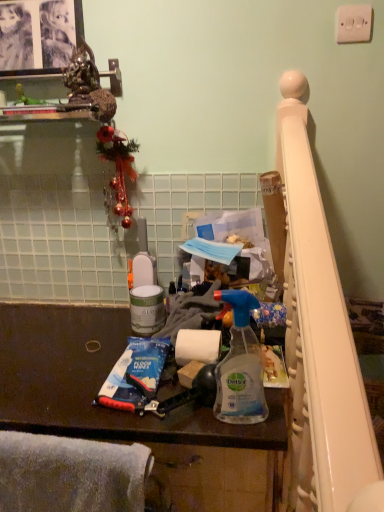
What is the approximate height of transparent plastic spray bottle at center?

The height of transparent plastic spray bottle at center is 11.19 inches.

I want to click on transparent plastic spray bottle at center, so click(240, 366).

What do you see at coordinates (135, 414) in the screenshot?
I see `dark brown laminate counter at center` at bounding box center [135, 414].

I want to click on white glossy paint can at center, so click(147, 309).

The image size is (384, 512). What are the coordinates of `transparent plastic spray bottle at center` in the screenshot? It's located at (240, 366).

How different are the orientations of transparent plastic spray bottle at center and dark brown laminate counter at center in degrees?

The angular difference between transparent plastic spray bottle at center and dark brown laminate counter at center is 0.00249 degrees.

Is transparent plastic spray bottle at center positioned with its back to dark brown laminate counter at center?

No, transparent plastic spray bottle at center is not facing away from dark brown laminate counter at center.

Is transparent plastic spray bottle at center taller or shorter than dark brown laminate counter at center?

In the image, transparent plastic spray bottle at center appears to be shorter than dark brown laminate counter at center.

From the image's perspective, which object appears higher, transparent plastic spray bottle at center or dark brown laminate counter at center?

transparent plastic spray bottle at center, from the image's perspective.

From the image's perspective, between white soft towel at lower left and white glossy paint can at center, which one is located above?

white glossy paint can at center is shown above in the image.

Is the depth of white soft towel at lower left greater than that of white glossy paint can at center?

No, white soft towel at lower left is closer to the camera.

Which object is wider, white soft towel at lower left or white glossy paint can at center?

white glossy paint can at center is wider.

Can you confirm if white soft towel at lower left is positioned to the left of white glossy paint can at center?

Yes.

Are white glossy paint can at center and transparent plastic spray bottle at center beside each other?

white glossy paint can at center is not next to transparent plastic spray bottle at center, and they're not touching.

Does white glossy paint can at center contain transparent plastic spray bottle at center?

No, white glossy paint can at center does not contain transparent plastic spray bottle at center.

Who is smaller, white glossy paint can at center or transparent plastic spray bottle at center?

Smaller between the two is white glossy paint can at center.

Can you confirm if white glossy paint can at center is thinner than transparent plastic spray bottle at center?

No, white glossy paint can at center is not thinner than transparent plastic spray bottle at center.

Which is correct: white soft towel at lower left is inside white plastic light switch at upper right, or outside of it?

white soft towel at lower left lies outside white plastic light switch at upper right.

The width and height of the screenshot is (384, 512). Find the location of `blanket in front of the white plastic light switch at upper right`. blanket in front of the white plastic light switch at upper right is located at coordinates pos(71,474).

Would you say white soft towel at lower left is a long distance from white plastic light switch at upper right?

Yes.

Which object is closer to the camera, white soft towel at lower left or white plastic light switch at upper right?

Positioned in front is white soft towel at lower left.

How much distance is there between blue plastic toothpaste at lower center and black glossy picture frame at upper left?

They are 35.18 inches apart.

Is blue plastic toothpaste at lower center to the left of black glossy picture frame at upper left from the viewer's perspective?

Incorrect, blue plastic toothpaste at lower center is not on the left side of black glossy picture frame at upper left.

Does blue plastic toothpaste at lower center have a smaller size compared to black glossy picture frame at upper left?

Yes.

Is blue plastic toothpaste at lower center touching black glossy picture frame at upper left?

No.

Considering the sizes of transparent plastic spray bottle at center and blue plastic toothpaste at lower center in the image, is transparent plastic spray bottle at center taller or shorter than blue plastic toothpaste at lower center?

Considering their sizes, transparent plastic spray bottle at center has more height than blue plastic toothpaste at lower center.

Is transparent plastic spray bottle at center in front of or behind blue plastic toothpaste at lower center in the image?

Clearly, transparent plastic spray bottle at center is in front of blue plastic toothpaste at lower center.

From the image's perspective, is transparent plastic spray bottle at center above or below blue plastic toothpaste at lower center?

transparent plastic spray bottle at center is situated higher than blue plastic toothpaste at lower center in the image.

Could you measure the distance between transparent plastic spray bottle at center and blue plastic toothpaste at lower center?

The distance of transparent plastic spray bottle at center from blue plastic toothpaste at lower center is 9.12 inches.

Does white glossy paint can at center touch dark brown laminate counter at center?

No, white glossy paint can at center is not next to dark brown laminate counter at center.

Looking at this image, is white glossy paint can at center turned away from dark brown laminate counter at center?

white glossy paint can at center is not turned away from dark brown laminate counter at center.

In the scene shown: Is white glossy paint can at center not inside dark brown laminate counter at center?

Yes, white glossy paint can at center is located beyond the bounds of dark brown laminate counter at center.

You are a GUI agent. You are given a task and a screenshot of the screen. Output one action in this format:
    pyautogui.click(x=<x>, y=<y>)
    Task: Click on the furniture behind the transparent plastic spray bottle at center
    The height and width of the screenshot is (512, 384).
    Given the screenshot: What is the action you would take?
    pyautogui.click(x=135, y=414)

Locate an element on the screen. The height and width of the screenshot is (512, 384). toiletry that is above the white soft towel at lower left (from the image's perspective) is located at coordinates (147, 309).

Which object lies further to the anchor point dark brown laminate counter at center, white soft towel at lower left or white plastic light switch at upper right?

white plastic light switch at upper right is positioned further to the anchor dark brown laminate counter at center.

Looking at the image, which one is located closer to blue plastic toothpaste at lower center, black glossy picture frame at upper left or dark brown laminate counter at center?

dark brown laminate counter at center is closer to blue plastic toothpaste at lower center.

When comparing their distances from blue plastic toothpaste at lower center, does dark brown laminate counter at center or white soft towel at lower left seem closer?

The object closer to blue plastic toothpaste at lower center is dark brown laminate counter at center.

When comparing their distances from dark brown laminate counter at center, does black glossy picture frame at upper left or white soft towel at lower left seem further?

The object further to dark brown laminate counter at center is black glossy picture frame at upper left.

In the scene shown: Which object lies further to the anchor point white glossy paint can at center, blue plastic toothpaste at lower center or dark brown laminate counter at center?

Based on the image, dark brown laminate counter at center appears to be further to white glossy paint can at center.

Consider the image. Looking at the image, which one is located closer to white soft towel at lower left, blue plastic toothpaste at lower center or black glossy picture frame at upper left?

blue plastic toothpaste at lower center is positioned closer to the anchor white soft towel at lower left.

When comparing their distances from black glossy picture frame at upper left, does white glossy paint can at center or transparent plastic spray bottle at center seem closer?

white glossy paint can at center is closer to black glossy picture frame at upper left.

When comparing their distances from white soft towel at lower left, does transparent plastic spray bottle at center or dark brown laminate counter at center seem further?

transparent plastic spray bottle at center lies further to white soft towel at lower left than the other object.

Where is `light switch between black glossy picture frame at upper left and white glossy paint can at center in the vertical direction`? The height and width of the screenshot is (512, 384). light switch between black glossy picture frame at upper left and white glossy paint can at center in the vertical direction is located at coordinates (353, 23).

Identify the location of bottle between white soft towel at lower left and white glossy paint can at center in the front-back direction. pos(240,366).

At what (x,y) coordinates should I click in order to perform the action: click on toothpaste between white plastic light switch at upper right and white soft towel at lower left vertically. Please return your answer as a coordinate pair (x, y). The image size is (384, 512). Looking at the image, I should click on (135, 374).

At what (x,y) coordinates should I click in order to perform the action: click on toothpaste between white soft towel at lower left and white glossy paint can at center from front to back. Please return your answer as a coordinate pair (x, y). The height and width of the screenshot is (512, 384). Looking at the image, I should click on (135, 374).